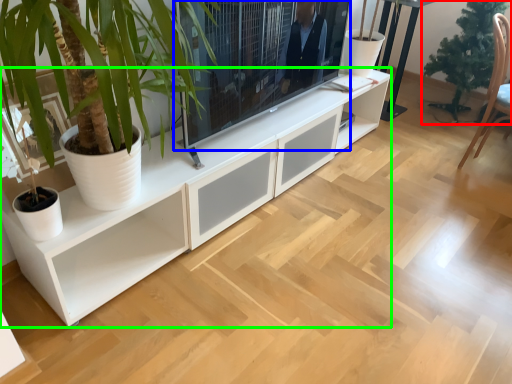
Question: Which object is the farthest from houseplant (highlighted by a red box)? Choose among these: television (highlighted by a blue box) or cabinetry (highlighted by a green box).

Choices:
 (A) television
 (B) cabinetry

Answer: (A)